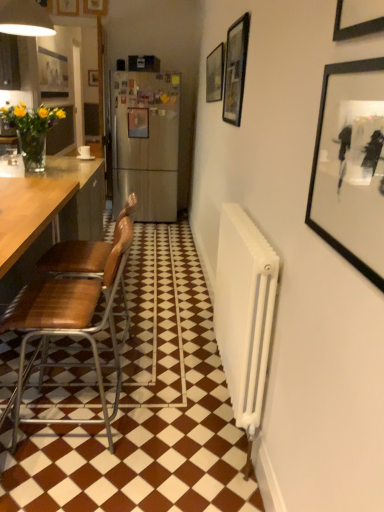
The width and height of the screenshot is (384, 512). I want to click on blank area beneath brown leather chair at left, placed as the 1th chair when sorted from front to back (from a real-world perspective), so click(x=89, y=429).